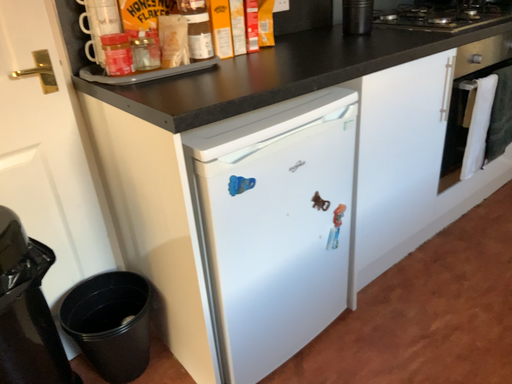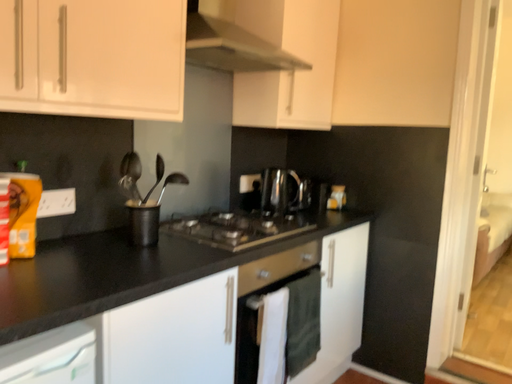
Question: Which way did the camera rotate in the video?

Choices:
 (A) rotated right
 (B) rotated left

Answer: (A)